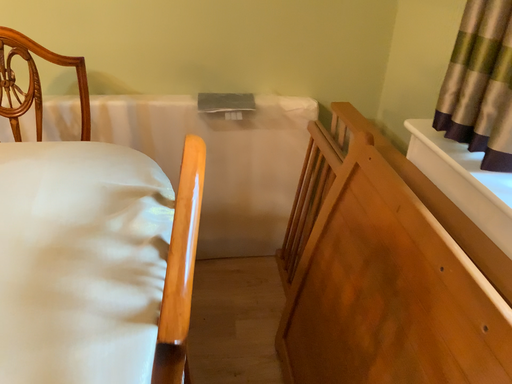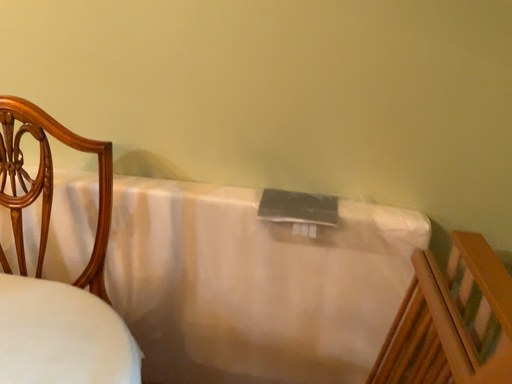
Question: How did the camera likely rotate when shooting the video?

Choices:
 (A) rotated downward
 (B) rotated upward

Answer: (B)